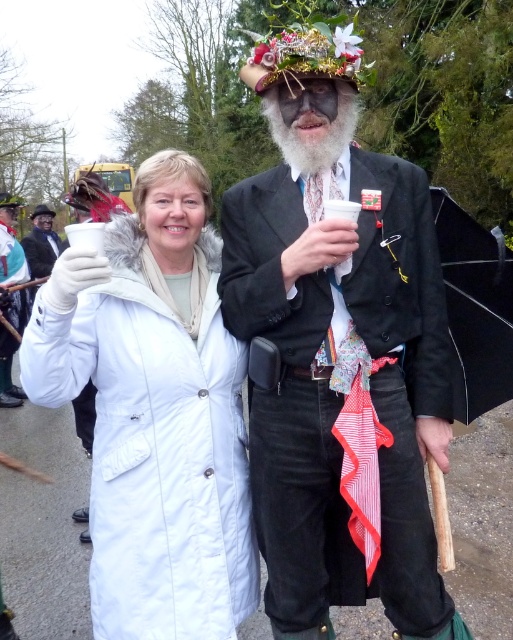
Who is taller, white fur-trimmed coat at center or matte black hat at upper left?

With more height is white fur-trimmed coat at center.

Does white fur-trimmed coat at center appear on the right side of matte black hat at upper left?

Indeed, white fur-trimmed coat at center is positioned on the right side of matte black hat at upper left.

Does point (106, 282) lie in front of point (62, 250)?

Yes, it is in front of point (62, 250).

This screenshot has height=640, width=513. In order to click on white fur-trimmed coat at center in this screenshot , I will do `click(154, 412)`.

Does shiny black coat at center appear over white fur-trimmed coat at center?

Yes.

Can you confirm if shiny black coat at center is thinner than white fur-trimmed coat at center?

In fact, shiny black coat at center might be wider than white fur-trimmed coat at center.

Which is in front, point (290, 285) or point (159, 604)?

Point (290, 285) is more forward.

What are the coordinates of `shiny black coat at center` in the screenshot? It's located at click(x=339, y=348).

Can you confirm if shiny black coat at center is positioned above white matte coat at center?

No, shiny black coat at center is not above white matte coat at center.

Between shiny black coat at center and white matte coat at center, which one has more height?

Standing taller between the two is white matte coat at center.

Is point (419, 372) positioned after point (5, 365)?

No, it is not.

Locate an element on the screen. shiny black coat at center is located at coordinates (339, 348).